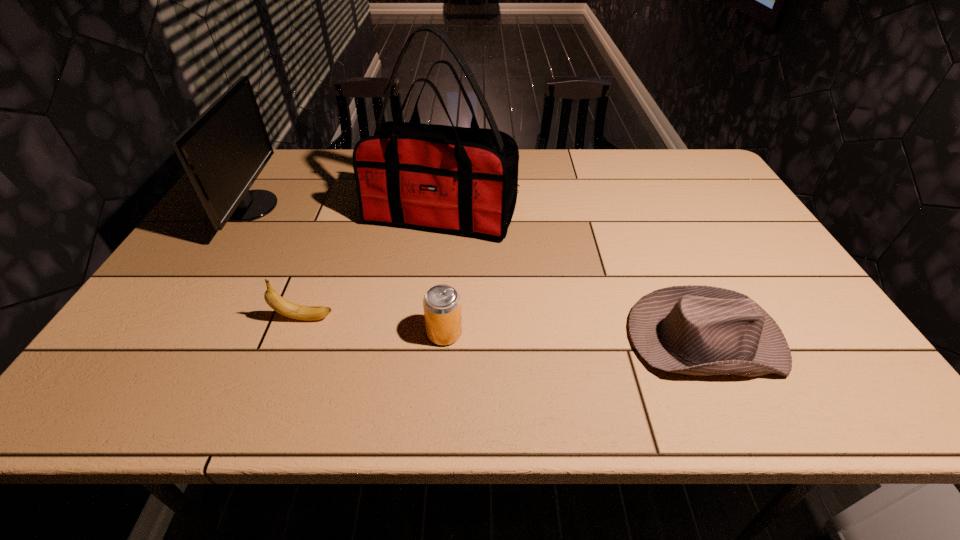
At what (x,y) coordinates should I click in order to perform the action: click on free space located 0.210m on the left of the rightmost object. Please return your answer as a coordinate pair (x, y). The height and width of the screenshot is (540, 960). Looking at the image, I should click on (533, 339).

Where is `object that is at the far edge`? The height and width of the screenshot is (540, 960). object that is at the far edge is located at coordinates (224, 150).

The height and width of the screenshot is (540, 960). Identify the location of object present at the near edge. (702, 330).

I want to click on object situated at the left edge, so click(x=224, y=150).

Locate an element on the screen. This screenshot has width=960, height=540. object that is at the right edge is located at coordinates (702, 330).

Locate an element on the screen. Image resolution: width=960 pixels, height=540 pixels. object at the far left corner is located at coordinates (224, 150).

Find the location of a particular element. The image size is (960, 540). object that is at the near right corner is located at coordinates (702, 330).

Image resolution: width=960 pixels, height=540 pixels. In order to click on vacant region at the far edge of the desktop in this screenshot , I will do (318, 160).

In the image, there is a desktop. Where is `free space at the left edge`? free space at the left edge is located at coordinates (226, 231).

The image size is (960, 540). I want to click on free space at the right edge of the desktop, so pos(789,328).